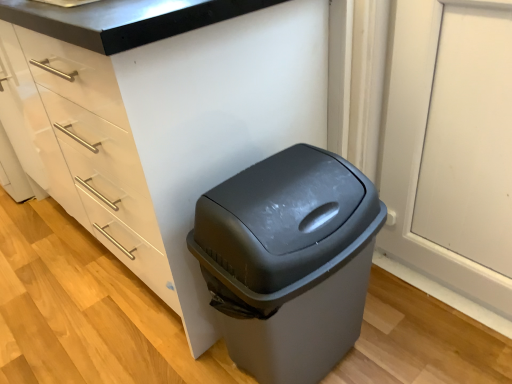
Question: From a real-world perspective, is white glossy cabinet at center above or below gray plastic trash can at center?

Choices:
 (A) above
 (B) below

Answer: (A)

Question: Is white glossy cabinet at center in front of or behind gray plastic trash can at center in the image?

Choices:
 (A) front
 (B) behind

Answer: (A)

Question: Would you say white glossy cabinet at center is to the left or to the right of gray plastic trash can at center in the picture?

Choices:
 (A) right
 (B) left

Answer: (B)

Question: Do you think gray plastic trash can at center is within white glossy cabinet at center, or outside of it?

Choices:
 (A) inside
 (B) outside

Answer: (B)

Question: Looking at their shapes, would you say gray plastic trash can at center is wider or thinner than white glossy cabinet at center?

Choices:
 (A) wide
 (B) thin

Answer: (B)

Question: Is gray plastic trash can at center in front of or behind white glossy cabinet at center in the image?

Choices:
 (A) front
 (B) behind

Answer: (B)

Question: From the image's perspective, relative to white glossy cabinet at center, is gray plastic trash can at center above or below?

Choices:
 (A) above
 (B) below

Answer: (B)